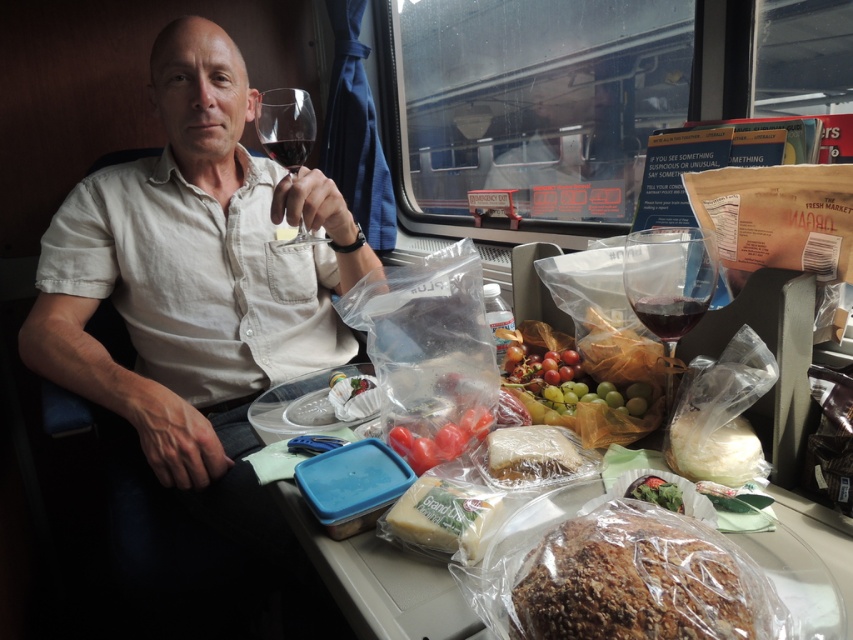
Question: Considering the real-world distances, which object is farthest from the glossy plastic grapes at center?

Choices:
 (A) translucent plastic bag at center
 (B) brown crumbly bread at center

Answer: (B)

Question: Can you confirm if white creamy cheese at center is wider than transparent glass at upper center?

Choices:
 (A) no
 (B) yes

Answer: (A)

Question: Does translucent plastic sandwich at center appear on the right side of dark red liquid at upper center?

Choices:
 (A) yes
 (B) no

Answer: (A)

Question: Is brown crumbly bread at center thinner than matte glass wine at center?

Choices:
 (A) yes
 (B) no

Answer: (B)

Question: Which point appears closest to the camera in this image?

Choices:
 (A) (608, 614)
 (B) (625, 291)

Answer: (A)

Question: Which object is the farthest from the glossy plastic grapes at center?

Choices:
 (A) green leafy salad at center
 (B) matte white shirt at upper left

Answer: (B)